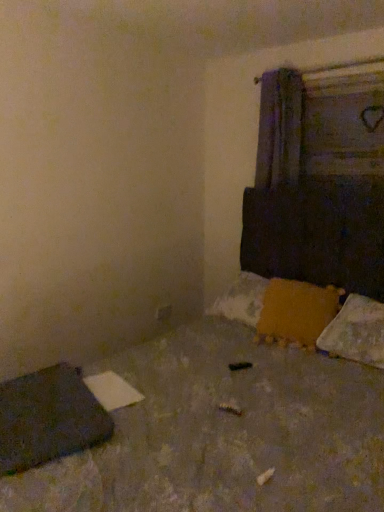
Question: Can you confirm if orange fuzzy pillow at lower right, the 2th pillow from the right, is thinner than dark gray fabric at lower left?

Choices:
 (A) yes
 (B) no

Answer: (B)

Question: Is orange fuzzy pillow at lower right, arranged as the first pillow when viewed from the left, turned away from dark gray fabric at lower left?

Choices:
 (A) no
 (B) yes

Answer: (A)

Question: From a real-world perspective, is orange fuzzy pillow at lower right, arranged as the first pillow when viewed from the left, positioned under dark gray fabric at lower left based on gravity?

Choices:
 (A) yes
 (B) no

Answer: (B)

Question: Could you tell me if orange fuzzy pillow at lower right, the 2th pillow from the right, is turned towards dark gray fabric at lower left?

Choices:
 (A) no
 (B) yes

Answer: (B)

Question: Is orange fuzzy pillow at lower right, the 2th pillow from the right, positioned behind dark gray fabric at lower left?

Choices:
 (A) no
 (B) yes

Answer: (B)

Question: From the image's perspective, is orange fuzzy pillow at lower right, arranged as the first pillow when viewed from the left, beneath dark gray fabric at lower left?

Choices:
 (A) no
 (B) yes

Answer: (A)

Question: Is orange fuzzy pillow at lower right, the 2th pillow from the right, turned away from white fluffy pillow at lower right, which is the second pillow from left to right?

Choices:
 (A) no
 (B) yes

Answer: (A)

Question: Does orange fuzzy pillow at lower right, the 2th pillow from the right, come behind white fluffy pillow at lower right, which is counted as the 1th pillow, starting from the right?

Choices:
 (A) yes
 (B) no

Answer: (A)

Question: Is orange fuzzy pillow at lower right, the 2th pillow from the right, in contact with white fluffy pillow at lower right, which is the second pillow from left to right?

Choices:
 (A) no
 (B) yes

Answer: (A)

Question: Is orange fuzzy pillow at lower right, arranged as the first pillow when viewed from the left, to the right of white fluffy pillow at lower right, which is counted as the 1th pillow, starting from the right, from the viewer's perspective?

Choices:
 (A) yes
 (B) no

Answer: (B)

Question: Can you confirm if orange fuzzy pillow at lower right, the 2th pillow from the right, is taller than white fluffy pillow at lower right, which is the second pillow from left to right?

Choices:
 (A) no
 (B) yes

Answer: (B)

Question: Does orange fuzzy pillow at lower right, the 2th pillow from the right, have a smaller size compared to white fluffy pillow at lower right, which is counted as the 1th pillow, starting from the right?

Choices:
 (A) yes
 (B) no

Answer: (B)

Question: From a real-world perspective, is dark gray fabric at lower left under white fluffy pillow at lower right, which is the second pillow from left to right?

Choices:
 (A) yes
 (B) no

Answer: (A)